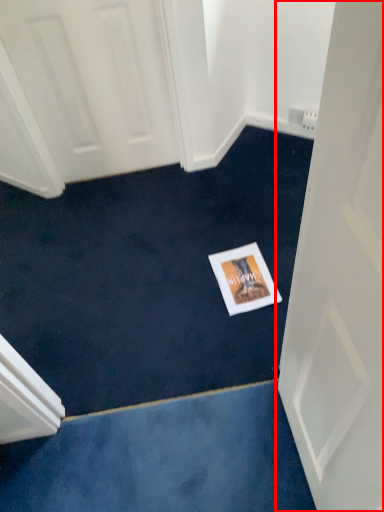
Question: In this image, where is door (annotated by the red box) located relative to postcard?

Choices:
 (A) left
 (B) right

Answer: (B)